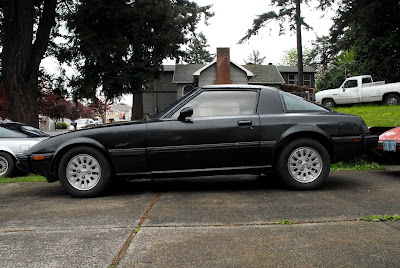
Locate an element on the screen. The image size is (400, 268). door is located at coordinates 348,101, 200,160.